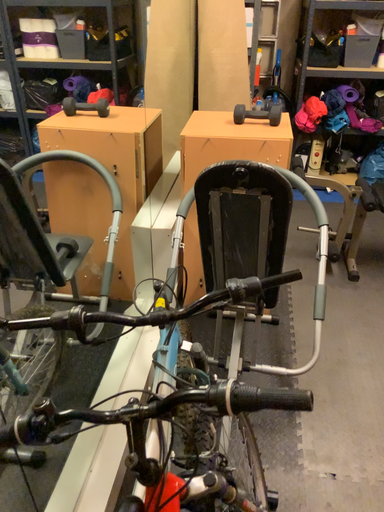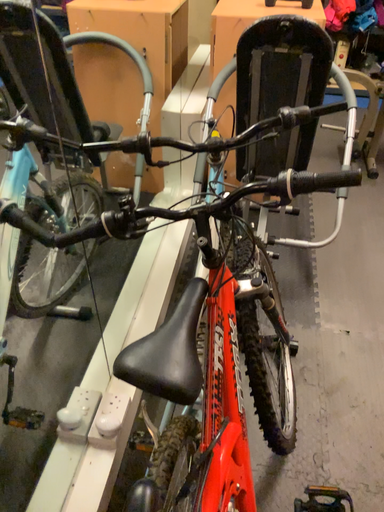
Question: Which way did the camera rotate in the video?

Choices:
 (A) rotated upward
 (B) rotated downward

Answer: (B)